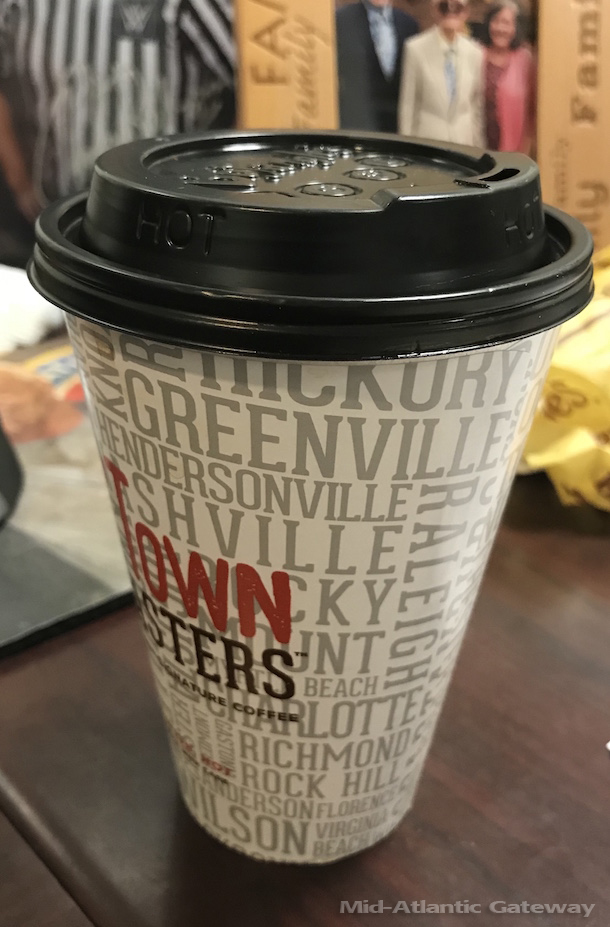
Identify the location of dark brown wooden table. (551, 743).